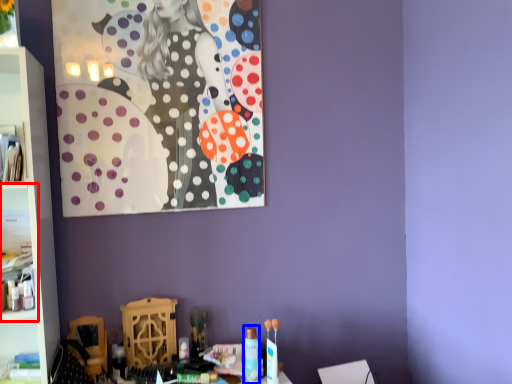
Question: Which object is closer to the camera taking this photo, cabinet (highlighted by a red box) or toiletry (highlighted by a blue box)?

Choices:
 (A) cabinet
 (B) toiletry

Answer: (A)